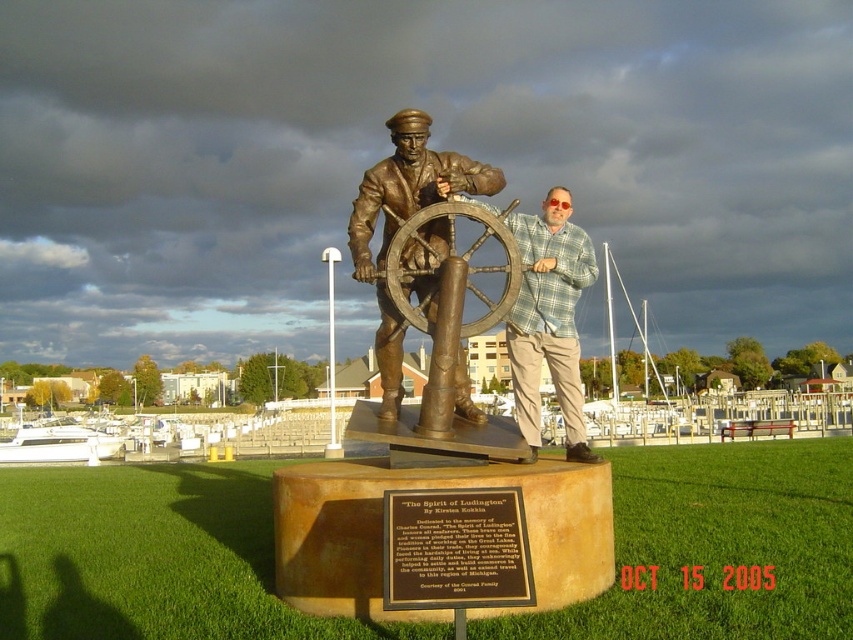
Question: Which point is closer to the camera?

Choices:
 (A) bronze plaque at center
 (B) white glossy boat at lower left
 (C) bronze statue at center

Answer: (A)

Question: Can you confirm if plaid shirt at center is positioned to the right of bronze/brass ship's wheel at center?

Choices:
 (A) no
 (B) yes

Answer: (B)

Question: Can you confirm if bronze statue at center is thinner than bronze plaque at center?

Choices:
 (A) no
 (B) yes

Answer: (B)

Question: Which is farther from the bronze statue at center?

Choices:
 (A) bronze/brass ship's wheel at center
 (B) plaid shirt at center
 (C) white glossy boat at lower left
 (D) bronze/smooth ship's wheel at center

Answer: (C)

Question: Can you confirm if bronze statue at center is positioned to the left of bronze/brass ship's wheel at center?

Choices:
 (A) no
 (B) yes

Answer: (B)

Question: Which object is positioned farthest from the white glossy boat at lower left?

Choices:
 (A) plaid shirt at center
 (B) bronze/smooth ship's wheel at center

Answer: (A)